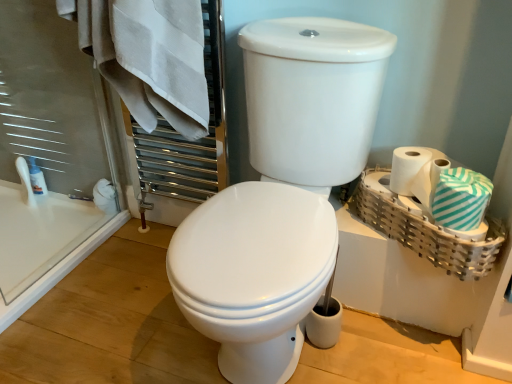
In order to click on free point to the left of white glossy toilet at center in this screenshot , I will do `click(112, 306)`.